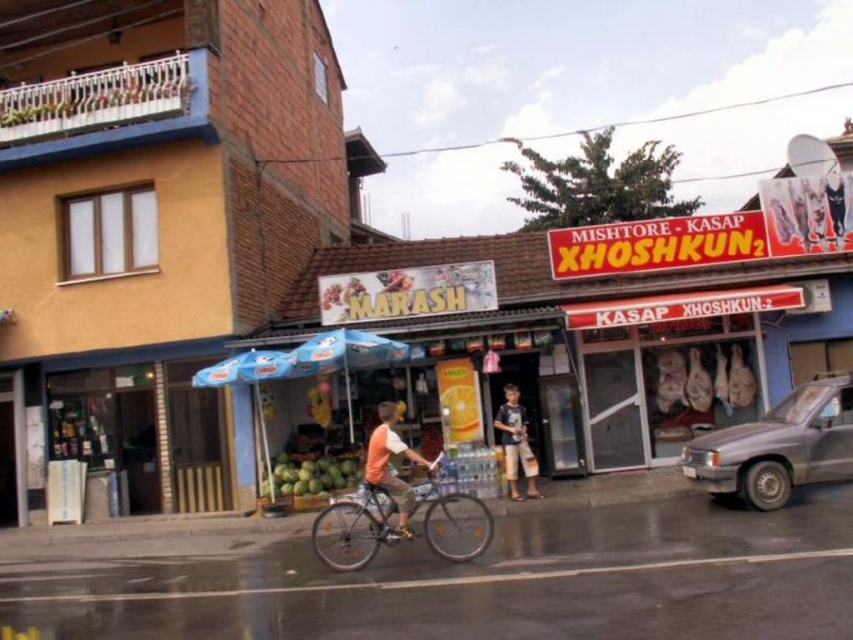
Question: Among these points, which one is nearest to the camera?

Choices:
 (A) (456, 554)
 (B) (368, 438)
 (C) (514, 426)

Answer: (A)

Question: In this image, where is orange cotton shirt at center located relative to dark blue cotton shirt at center?

Choices:
 (A) below
 (B) above

Answer: (B)

Question: Among these points, which one is farthest from the camera?

Choices:
 (A) (350, 545)
 (B) (323, 467)
 (C) (515, 468)

Answer: (B)

Question: Can you confirm if green matte coconuts at center is thinner than dark blue cotton shirt at center?

Choices:
 (A) no
 (B) yes

Answer: (A)

Question: Which point is farther from the camera taking this photo?

Choices:
 (A) (389, 435)
 (B) (814, 440)

Answer: (B)

Question: Is the position of orange cotton shirt at center less distant than that of green matte coconuts at center?

Choices:
 (A) yes
 (B) no

Answer: (A)